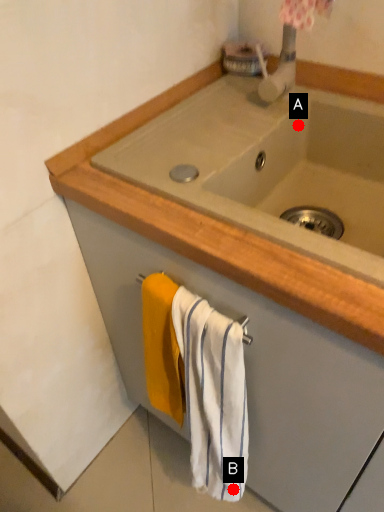
Question: Two points are circled on the image, labeled by A and B beside each circle. Which point is further to the camera?

Choices:
 (A) A is further
 (B) B is further

Answer: (A)